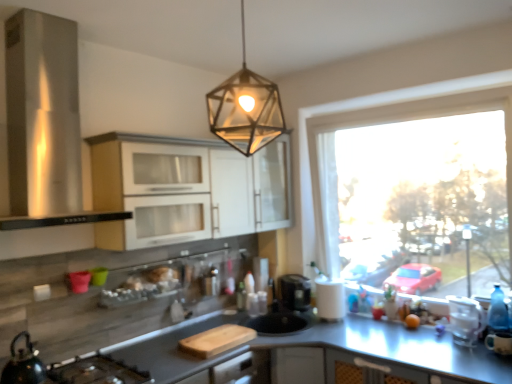
Question: From the image's perspective, is matte white cabinet at upper center, which is the 1th cabinetry from back to front, located beneath clear plastic container at right?

Choices:
 (A) no
 (B) yes

Answer: (A)

Question: Is matte white cabinet at upper center, positioned as the second cabinetry in front-to-back order, taller than clear plastic container at right?

Choices:
 (A) no
 (B) yes

Answer: (B)

Question: Can you confirm if matte white cabinet at upper center, which is the 1th cabinetry from back to front, is wider than clear plastic container at right?

Choices:
 (A) no
 (B) yes

Answer: (B)

Question: From a real-world perspective, is matte white cabinet at upper center, which is the 1th cabinetry from back to front, on top of clear plastic container at right?

Choices:
 (A) no
 (B) yes

Answer: (B)

Question: From a real-world perspective, is matte white cabinet at upper center, positioned as the second cabinetry in front-to-back order, physically below clear plastic container at right?

Choices:
 (A) no
 (B) yes

Answer: (A)

Question: Is matte white cabinet at upper center, which is the 1th cabinetry from back to front, to the right of clear plastic container at right from the viewer's perspective?

Choices:
 (A) yes
 (B) no

Answer: (B)

Question: Considering the relative sizes of metallic hexagonal light fixture at upper center and white matte paper towel at right in the image provided, is metallic hexagonal light fixture at upper center taller than white matte paper towel at right?

Choices:
 (A) yes
 (B) no

Answer: (A)

Question: From the image's perspective, is metallic hexagonal light fixture at upper center over white matte paper towel at right?

Choices:
 (A) no
 (B) yes

Answer: (B)

Question: Is metallic hexagonal light fixture at upper center to the left of white matte paper towel at right from the viewer's perspective?

Choices:
 (A) yes
 (B) no

Answer: (A)

Question: From the image's perspective, is metallic hexagonal light fixture at upper center under white matte paper towel at right?

Choices:
 (A) no
 (B) yes

Answer: (A)

Question: Does metallic hexagonal light fixture at upper center have a greater width compared to white matte paper towel at right?

Choices:
 (A) no
 (B) yes

Answer: (B)

Question: Is metallic hexagonal light fixture at upper center smaller than white matte paper towel at right?

Choices:
 (A) no
 (B) yes

Answer: (A)

Question: Is transparent glass window at right not near stainless steel range hood at left?

Choices:
 (A) yes
 (B) no

Answer: (A)